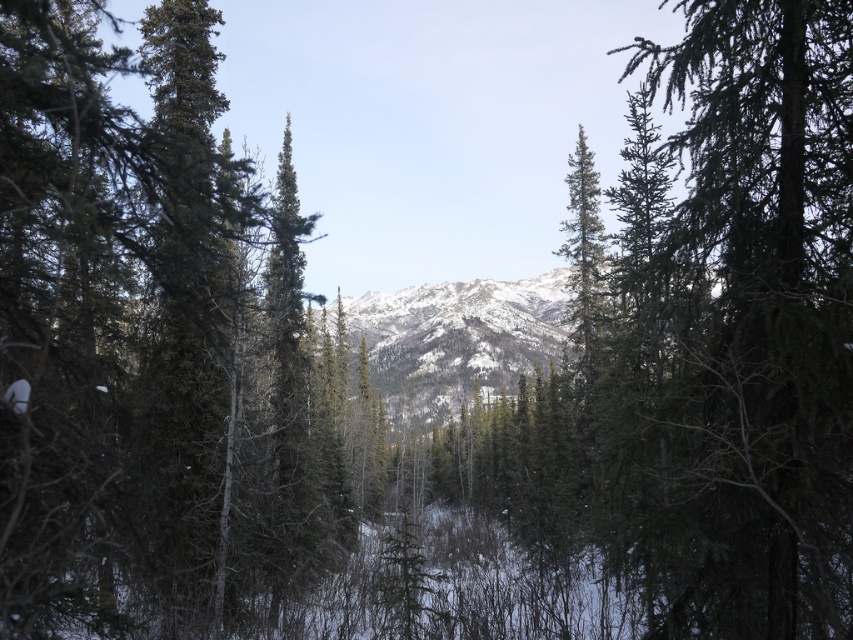
Does point (91, 74) come closer to viewer compared to point (676, 364)?

Yes, point (91, 74) is in front of point (676, 364).

Which of these two, green matte tree at left or green needle-like at right, stands shorter?

green needle-like at right

Identify the location of green matte tree at left. (148, 342).

At what (x,y) coordinates should I click in order to perform the action: click on green matte tree at left. Please return your answer as a coordinate pair (x, y). Looking at the image, I should click on (148, 342).